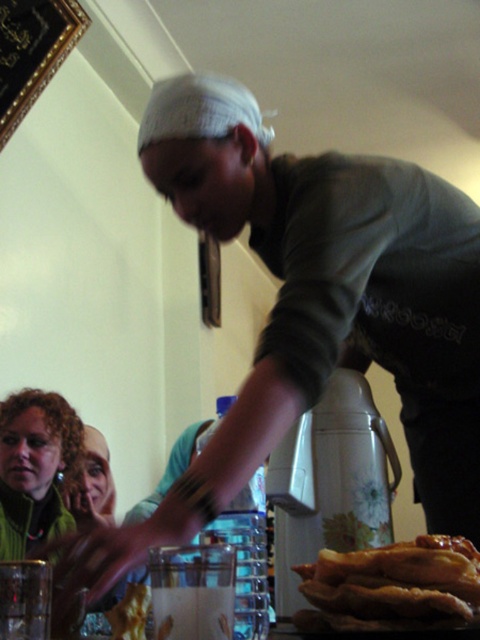
Who is positioned more to the right, white plastic blender at center or golden crispy pastry at lower right?

golden crispy pastry at lower right

Which is behind, point (363, 444) or point (432, 564)?

The point (363, 444) is more distant.

Identify the location of white plastic blender at center. This screenshot has height=640, width=480. (330, 483).